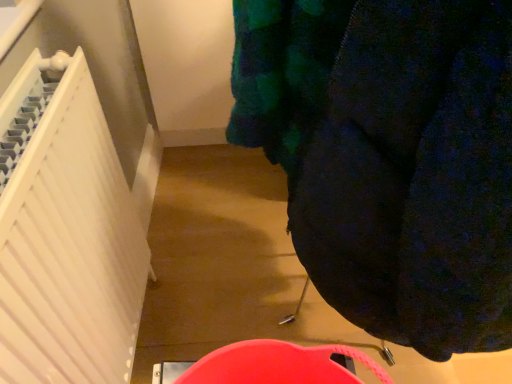
In order to face white matte radiator at left, should I rotate leftwards or rightwards?

You should look left and rotate roughly 22.979 degrees.

What do you see at coordinates (65, 233) in the screenshot? I see `white matte radiator at left` at bounding box center [65, 233].

This screenshot has width=512, height=384. I want to click on white matte radiator at left, so click(x=65, y=233).

Locate an element on the screen. The width and height of the screenshot is (512, 384). dark blue fabric at center is located at coordinates (390, 157).

This screenshot has width=512, height=384. What do you see at coordinates (390, 157) in the screenshot? I see `dark blue fabric at center` at bounding box center [390, 157].

Locate an element on the screen. This screenshot has height=384, width=512. white matte radiator at left is located at coordinates (65, 233).

From the picture: Is dark blue fabric at center at the left side of white matte radiator at left?

In fact, dark blue fabric at center is to the right of white matte radiator at left.

Considering their positions, is dark blue fabric at center located in front of or behind white matte radiator at left?

In the image, dark blue fabric at center appears in front of white matte radiator at left.

Consider the image. Which point is more forward, (384, 122) or (21, 249)?

The point (384, 122) is more forward.

From the image's perspective, is dark blue fabric at center on white matte radiator at left?

Indeed, from the image's perspective, dark blue fabric at center is shown above white matte radiator at left.

From a real-world perspective, is dark blue fabric at center below white matte radiator at left?

No, from a real-world perspective, dark blue fabric at center is not below white matte radiator at left.

Is dark blue fabric at center wider or thinner than white matte radiator at left?

dark blue fabric at center is wider than white matte radiator at left.

Considering the sizes of dark blue fabric at center and white matte radiator at left in the image, is dark blue fabric at center taller or shorter than white matte radiator at left?

Clearly, dark blue fabric at center is taller compared to white matte radiator at left.

Considering the sizes of objects dark blue fabric at center and white matte radiator at left in the image provided, who is smaller, dark blue fabric at center or white matte radiator at left?

white matte radiator at left is smaller.

Is white matte radiator at left surrounded by dark blue fabric at center?

No, white matte radiator at left is not inside dark blue fabric at center.

Is dark blue fabric at center not near white matte radiator at left?

No, dark blue fabric at center is not far away from white matte radiator at left.

Could you tell me if dark blue fabric at center is facing white matte radiator at left?

No, dark blue fabric at center is not turned towards white matte radiator at left.

Can you tell me how much dark blue fabric at center and white matte radiator at left differ in facing direction?

There is a 2.05-degree angle between the facing directions of dark blue fabric at center and white matte radiator at left.

Measure the distance from dark blue fabric at center to white matte radiator at left.

dark blue fabric at center is 17.97 inches from white matte radiator at left.

The width and height of the screenshot is (512, 384). What are the coordinates of `radiator below the dark blue fabric at center (from the image's perspective)` in the screenshot? It's located at tap(65, 233).

Can you confirm if white matte radiator at left is positioned to the left of dark blue fabric at center?

Correct, you'll find white matte radiator at left to the left of dark blue fabric at center.

Which object is further away from the camera taking this photo, white matte radiator at left or dark blue fabric at center?

white matte radiator at left is more distant.

Between point (94, 108) and point (372, 37), which one is positioned behind?

The point (94, 108) is farther.

From the image's perspective, which one is positioned lower, white matte radiator at left or dark blue fabric at center?

From the image's view, white matte radiator at left is below.

From a real-world perspective, who is located higher, white matte radiator at left or dark blue fabric at center?

dark blue fabric at center is physically above.

Does white matte radiator at left have a lesser width compared to dark blue fabric at center?

Yes, white matte radiator at left is thinner than dark blue fabric at center.

Is white matte radiator at left taller or shorter than dark blue fabric at center?

Considering their sizes, white matte radiator at left has less height than dark blue fabric at center.

From the picture: Is white matte radiator at left bigger than dark blue fabric at center?

Incorrect, white matte radiator at left is not larger than dark blue fabric at center.

Is white matte radiator at left inside the boundaries of dark blue fabric at center, or outside?

white matte radiator at left exists outside the volume of dark blue fabric at center.

Is white matte radiator at left positioned far away from dark blue fabric at center?

No, white matte radiator at left is not far from dark blue fabric at center.

Consider the image. Is white matte radiator at left positioned with its back to dark blue fabric at center?

No.

Identify the location of clothing on the right of white matte radiator at left. (390, 157).

Identify the location of clothing above the white matte radiator at left (from a real-world perspective). (390, 157).

I want to click on clothing that is on the right side of white matte radiator at left, so click(390, 157).